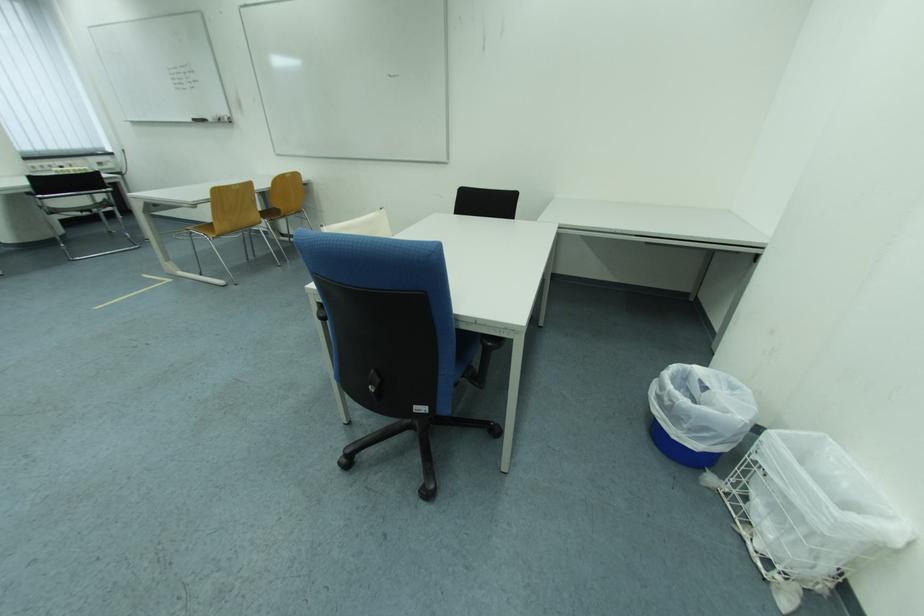
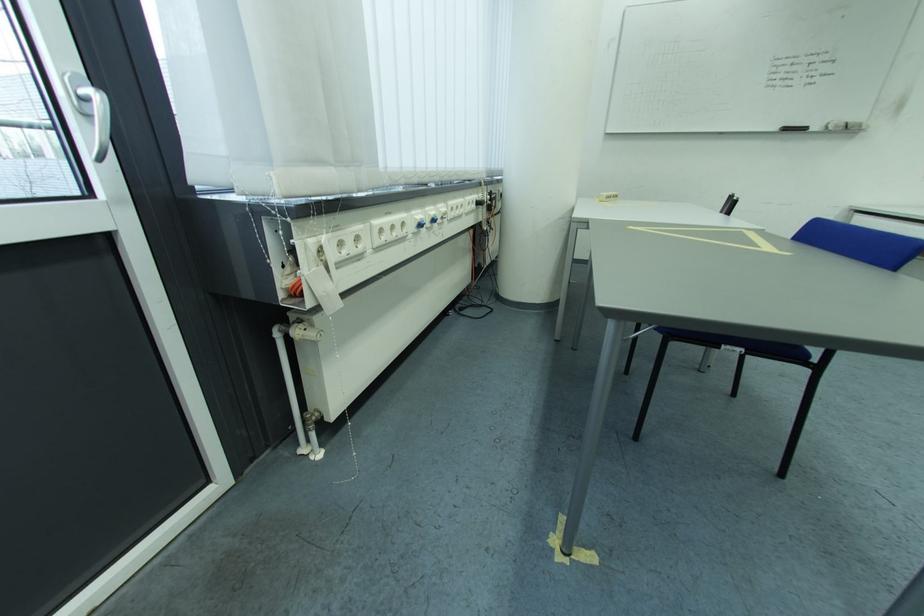
Find the pixel in the second image that matches (222,122) in the first image.

(845, 129)